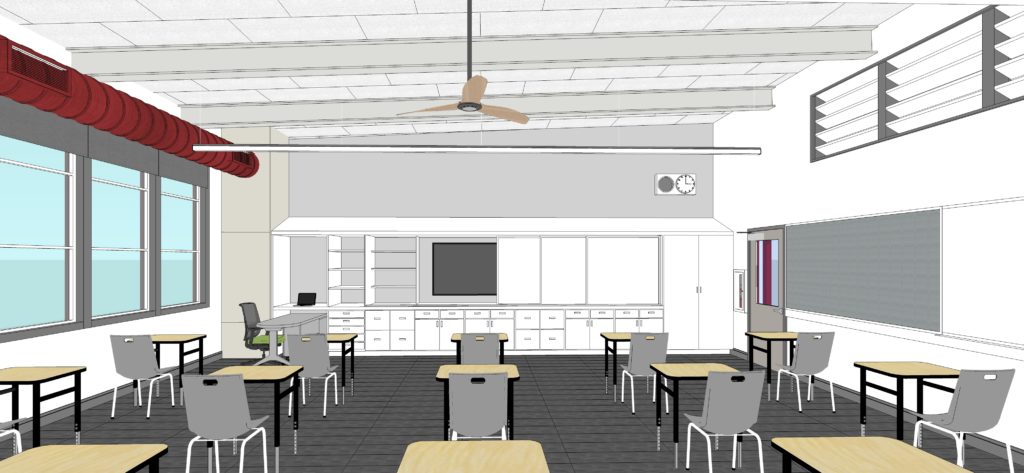
This screenshot has width=1024, height=473. I want to click on green chair, so click(x=264, y=341).